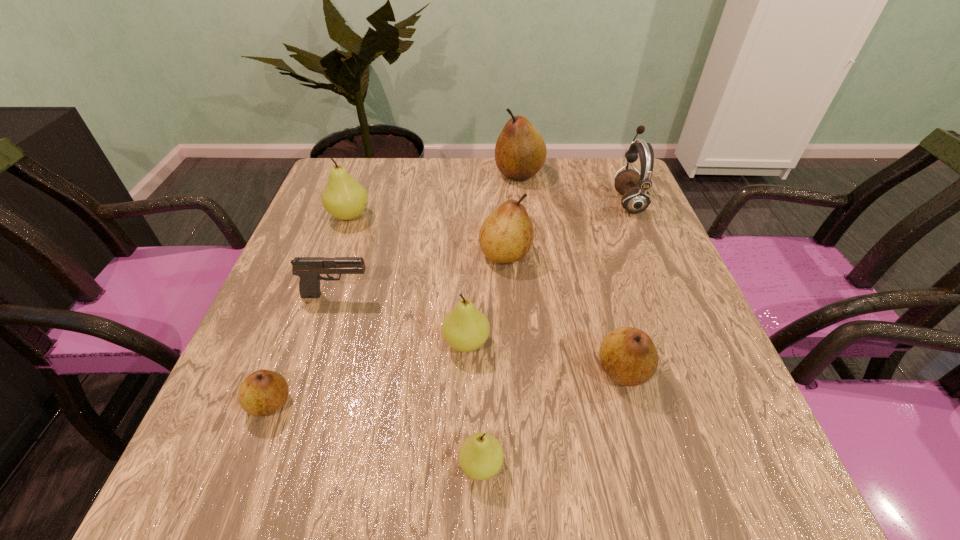
Where is `pear that is at the right edge`? pear that is at the right edge is located at coordinates (628, 355).

The image size is (960, 540). In order to click on object located in the far left corner section of the desktop in this screenshot , I will do `click(344, 198)`.

Identify the location of object at the far right corner. (633, 185).

In the image, there is a desktop. At what (x,y) coordinates should I click in order to perform the action: click on free region at the far edge. Please return your answer as a coordinate pair (x, y). The image size is (960, 540). Looking at the image, I should click on (509, 199).

In the image, there is a desktop. Find the location of `vacant space at the left edge`. vacant space at the left edge is located at coordinates (317, 215).

You are a GUI agent. You are given a task and a screenshot of the screen. Output one action in this format:
    pyautogui.click(x=<x>, y=<y>)
    Task: Click on the vacant space at the right edge of the desktop
    The image size is (960, 540).
    Given the screenshot: What is the action you would take?
    pyautogui.click(x=718, y=362)

Identify the location of vacant space at the far left corner of the desktop. (371, 167).

Locate an element on the screen. free space at the near left corner is located at coordinates click(x=253, y=453).

Image resolution: width=960 pixels, height=540 pixels. I want to click on free space between the earphone and the second farthest pear, so click(x=489, y=208).

Image resolution: width=960 pixels, height=540 pixels. I want to click on empty space that is in between the fifth nearest pear and the smallest brown pear, so click(x=388, y=329).